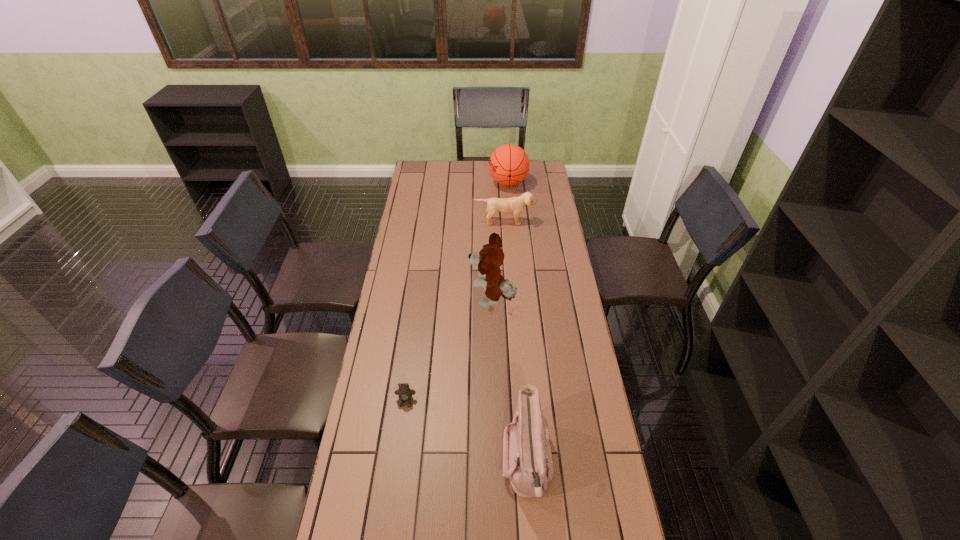
The height and width of the screenshot is (540, 960). I want to click on the third nearest object, so click(x=490, y=257).

Where is `the taller puppy`? The image size is (960, 540). the taller puppy is located at coordinates (490, 257).

Where is `basketball`? The width and height of the screenshot is (960, 540). basketball is located at coordinates (509, 164).

The height and width of the screenshot is (540, 960). I want to click on the farthest object, so click(x=509, y=164).

At what (x,y) coordinates should I click in order to perform the action: click on shoulder bag. Please return your answer as a coordinate pair (x, y). This screenshot has height=540, width=960. Looking at the image, I should click on (527, 458).

Where is `the shorter puppy`? the shorter puppy is located at coordinates (515, 205).

I want to click on the farther puppy, so (x=515, y=205).

What are the coordinates of `teddy bear` in the screenshot? It's located at (404, 393).

Find the location of a particular element. the leftmost object is located at coordinates (404, 393).

Where is `vacant space located 0.100m on the face of the third farthest object`? The image size is (960, 540). vacant space located 0.100m on the face of the third farthest object is located at coordinates (x=444, y=300).